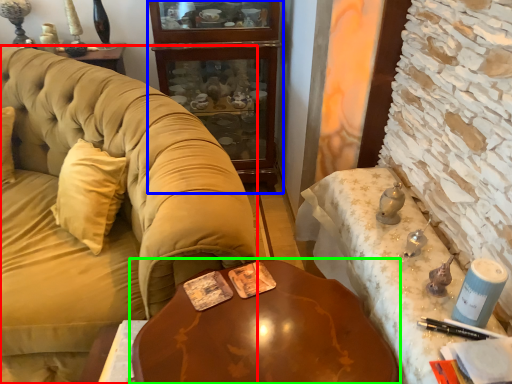
Question: Based on their relative distances, which object is nearer to studio couch (highlighted by a red box)? Choose from cabinetry (highlighted by a blue box) and table (highlighted by a green box).

Choices:
 (A) cabinetry
 (B) table

Answer: (B)